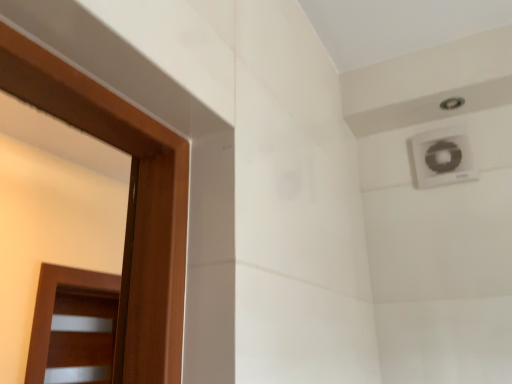
The width and height of the screenshot is (512, 384). Find the location of `white plastic air conditioning at upper right`. white plastic air conditioning at upper right is located at coordinates (442, 157).

What do you see at coordinates (442, 157) in the screenshot? I see `white plastic air conditioning at upper right` at bounding box center [442, 157].

What is the approximate width of white plastic air conditioning at upper right?

white plastic air conditioning at upper right is 2.78 centimeters in width.

Measure the distance between white plastic air conditioning at upper right and camera.

white plastic air conditioning at upper right is 3.84 feet away from camera.

I want to click on white plastic air conditioning at upper right, so click(442, 157).